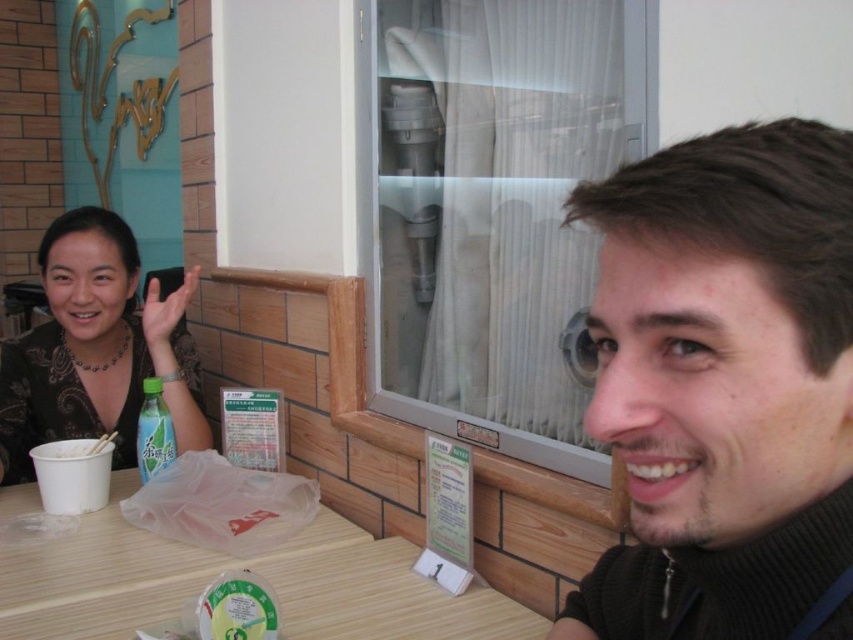
Question: Among these points, which one is farthest from the camera?

Choices:
 (A) (132, 259)
 (B) (160, 276)

Answer: (B)

Question: Does dark brown hair at right appear on the left side of matte black dress at left?

Choices:
 (A) yes
 (B) no

Answer: (B)

Question: Which object is positioned closest to the green matte bottle at center?

Choices:
 (A) matte black hand at upper left
 (B) dark brown hair at right

Answer: (A)

Question: Which object is positioned closest to the dark brown hair at right?

Choices:
 (A) matte black dress at left
 (B) matte black hand at upper left

Answer: (A)

Question: Can you confirm if dark brown hair at right is positioned to the right of green matte bottle at center?

Choices:
 (A) no
 (B) yes

Answer: (B)

Question: Is dark brown hair at right further to camera compared to matte black hand at upper left?

Choices:
 (A) no
 (B) yes

Answer: (A)